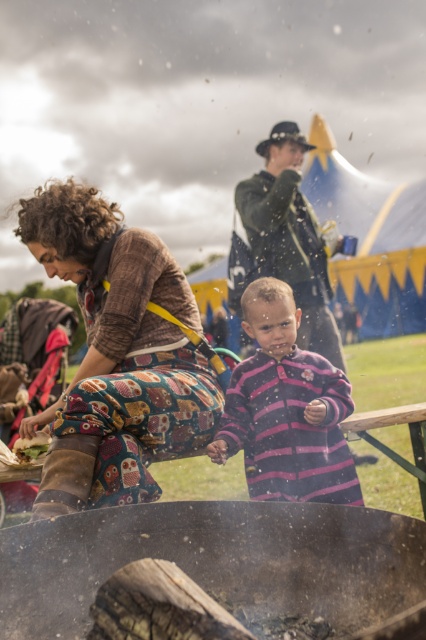
Question: Is the position of printed fabric pants at center less distant than that of green fabric hat at upper center?

Choices:
 (A) yes
 (B) no

Answer: (A)

Question: Among these points, which one is nearest to the camera?

Choices:
 (A) (247, 392)
 (B) (14, 532)

Answer: (B)

Question: Among these objects, which one is farthest from the camera?

Choices:
 (A) pink striped sweater at center
 (B) printed fabric pants at center
 (C) charcoal black wood at lower center

Answer: (A)

Question: Does charcoal black wood at lower center appear under printed fabric pants at center?

Choices:
 (A) yes
 (B) no

Answer: (A)

Question: Considering the relative positions of charcoal black wood at lower center and green fabric hat at upper center in the image provided, where is charcoal black wood at lower center located with respect to green fabric hat at upper center?

Choices:
 (A) above
 (B) below

Answer: (B)

Question: Based on their relative distances, which object is nearer to the charcoal black wood at lower center?

Choices:
 (A) grilled bread at lower left
 (B) green fabric hat at upper center
 (C) pink striped sweater at center

Answer: (C)